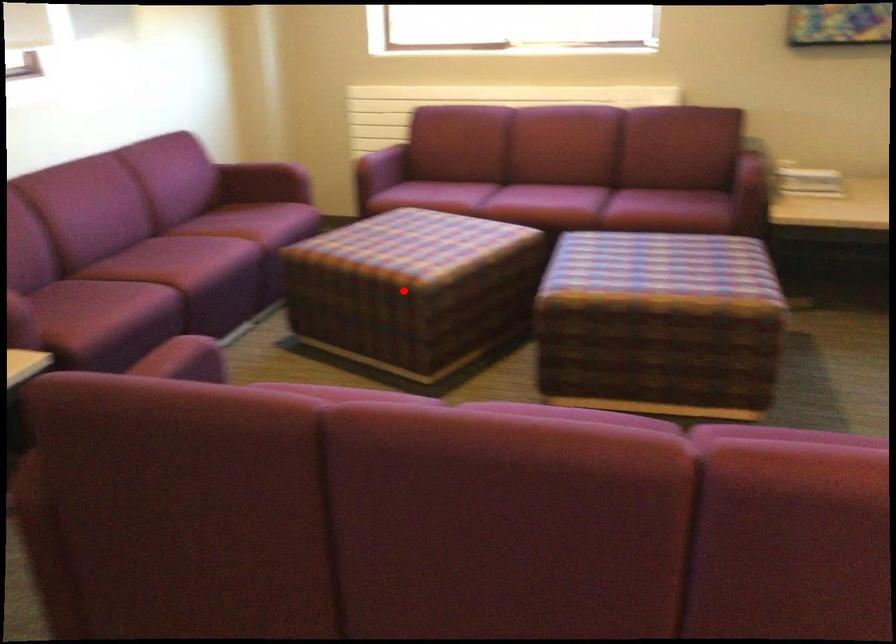
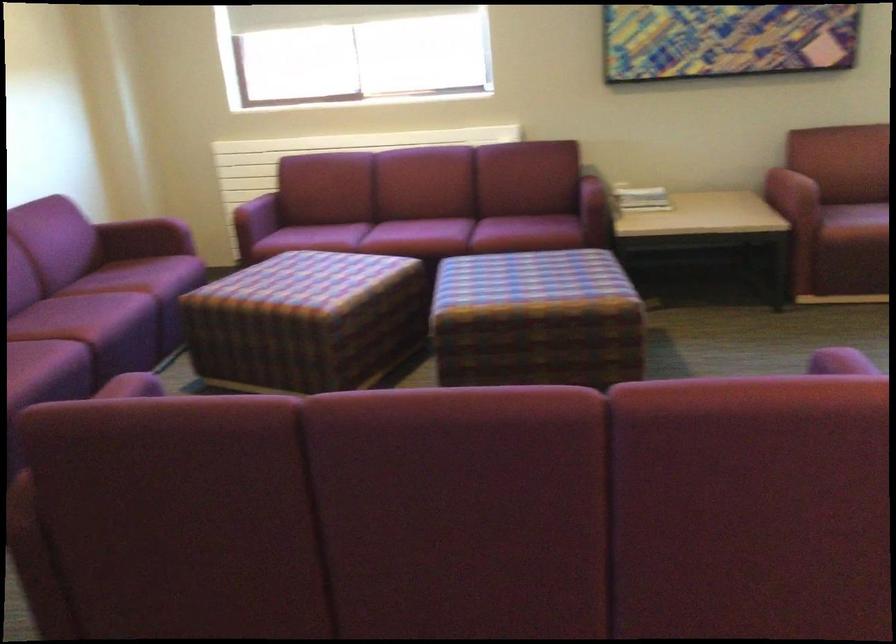
The point at the highlighted location is marked in the first image. Where is the corresponding point in the second image?

(306, 321)